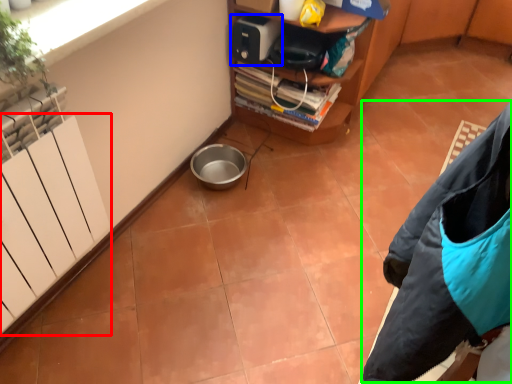
Question: Which object is the closest to the radiator (highlighted by a red box)? Choose among these: appliance (highlighted by a blue box) or jacket (highlighted by a green box).

Choices:
 (A) appliance
 (B) jacket

Answer: (B)